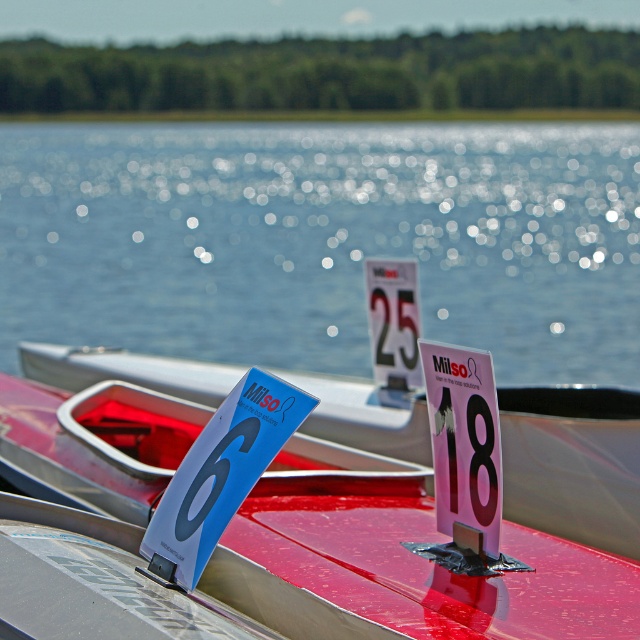
Looking at this image, you are standing at the lakeside and want to determine the relative positions of two points marked in the image. Which point is closer to you, point (461, 424) or point (378, 301)?

Point (461, 424) is closer to the viewer than point (378, 301).

You are a spectator at the lakeside event. You see the glistening water at center and the pink paper sign at center. Which object is positioned to the left?

The glistening water at center is positioned to the left of the pink paper sign at center.